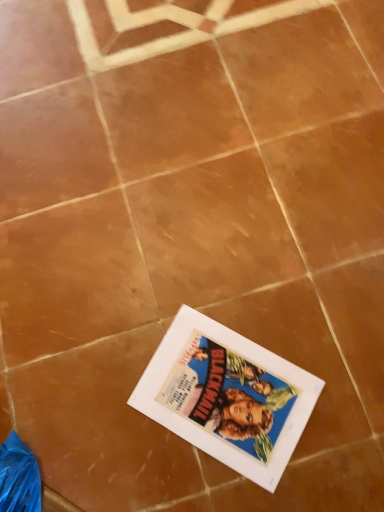
You are a GUI agent. You are given a task and a screenshot of the screen. Output one action in this format:
    pyautogui.click(x=<x>, y=<y>)
    Task: Click on the vacant region in front of matte paper book cover at center
    
    Given the screenshot: What is the action you would take?
    pyautogui.click(x=251, y=485)